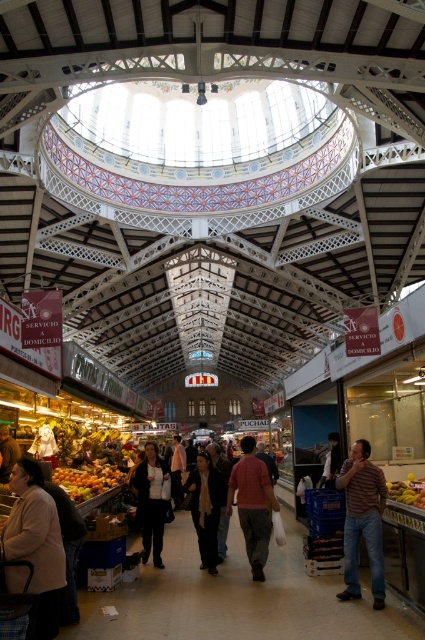
You are a customer in the market and want to find a specific item. You see the matte black jacket at center and the dark gray sweater at center. Which one is shorter in height?

The matte black jacket at center has a lesser height compared to the dark gray sweater at center, so the matte black jacket at center is shorter.

From the picture: You are a customer in the market and want to buy a jacket and a sweater. You notice the matte black jacket at center and the dark gray sweater at center. Which one is smaller in size?

The matte black jacket at center is smaller in size compared to the dark gray sweater at center.